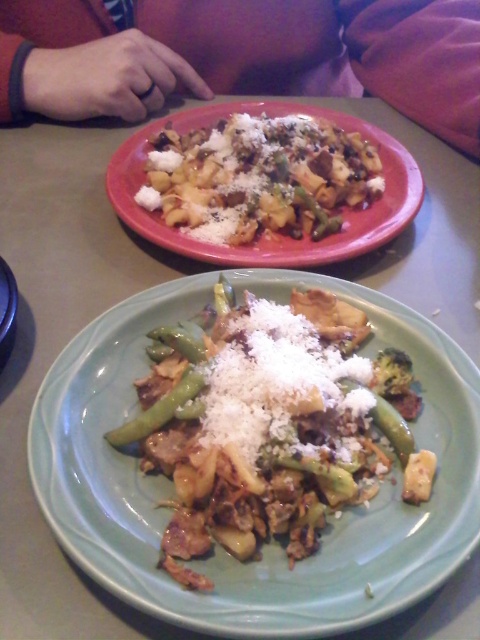
Question: Which point is farther to the camera?

Choices:
 (A) (288, 243)
 (B) (168, 580)

Answer: (A)

Question: Is green matte plate at center to the right of matte ceramic plate at upper center from the viewer's perspective?

Choices:
 (A) no
 (B) yes

Answer: (A)

Question: Can you confirm if green matte plate at center is smaller than matte ceramic plate at upper center?

Choices:
 (A) yes
 (B) no

Answer: (A)

Question: Which point is closer to the camera?

Choices:
 (A) (133, 314)
 (B) (423, 192)

Answer: (A)

Question: Among these points, which one is nearest to the camera?

Choices:
 (A) (380, 216)
 (B) (95, 440)

Answer: (B)

Question: Can you confirm if green matte plate at center is positioned to the left of matte ceramic plate at upper center?

Choices:
 (A) no
 (B) yes

Answer: (B)